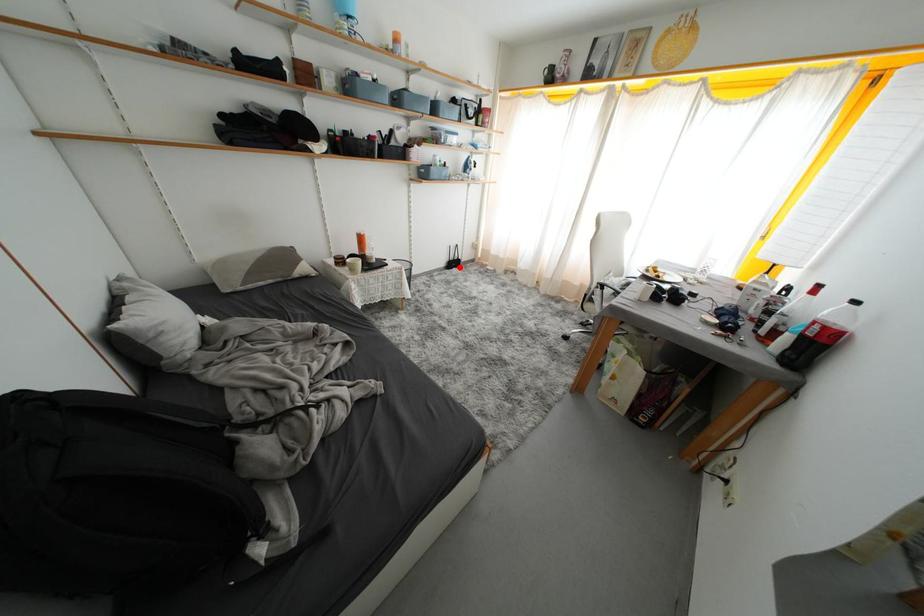
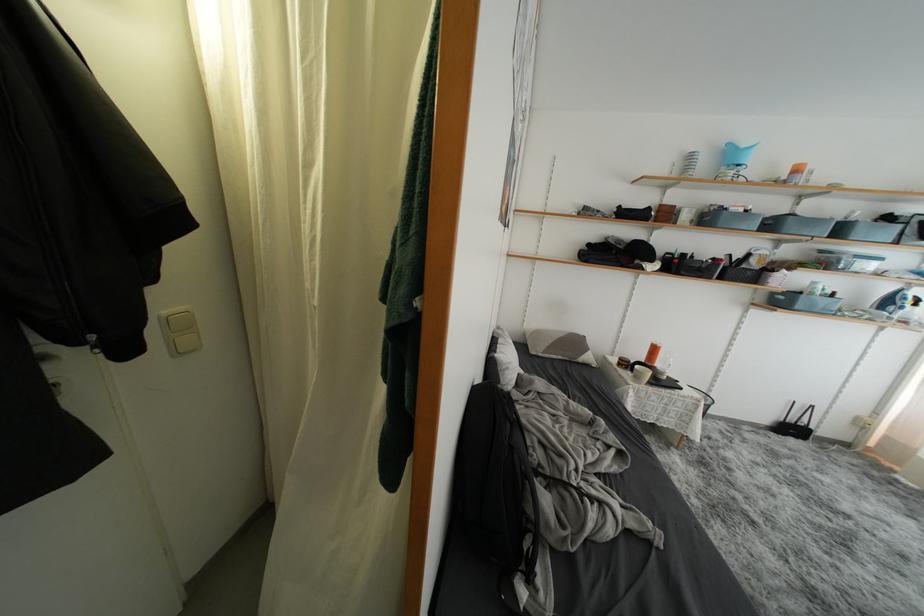
Locate, in the second image, the point that corresponds to the highlighted location in the first image.

(797, 434)